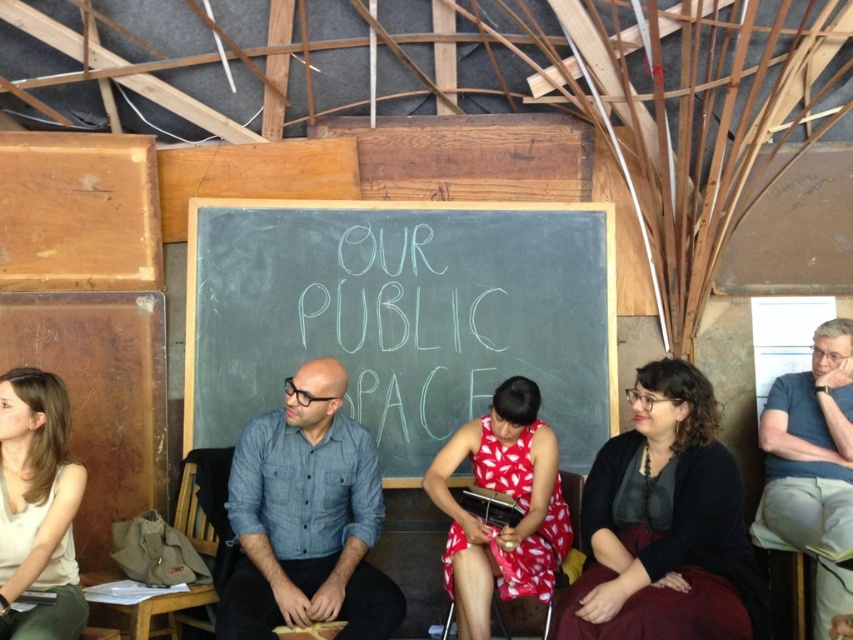
You are organizing a clothing donation drive and need to categorize shirts by size. You have two shirts to sort out. The denim shirt at center and the light beige fabric shirt at lower left. Which shirt should be placed in the larger size bin?

The denim shirt at center should be placed in the larger size bin because its width is larger than the light beige fabric shirt at lower left.

You are an event planner setting up a presentation area. You need to place a projector screen where it can be seen by everyone in the room. The green chalkboard at center and the white chalk writing at center are in the way. Which object should you move to clear the path for the projector screen?

The green chalkboard at center is in front of the white chalk writing at center. To clear the path for the projector screen, you should move the green chalkboard at center since it is blocking the view to the white chalk writing at center.

You are standing in the room and want to reach a point that is 3 meters away from you. Is the point at coordinates point (300, 397) within that distance?

The distance of point (300, 397) from viewer is 3.11 meters, so it is slightly beyond the 3 meters you want to reach.